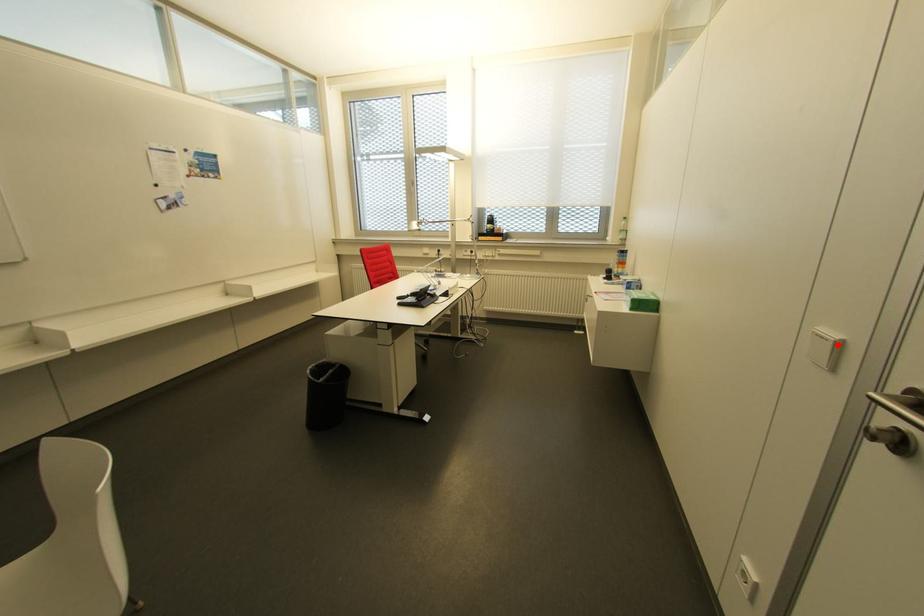
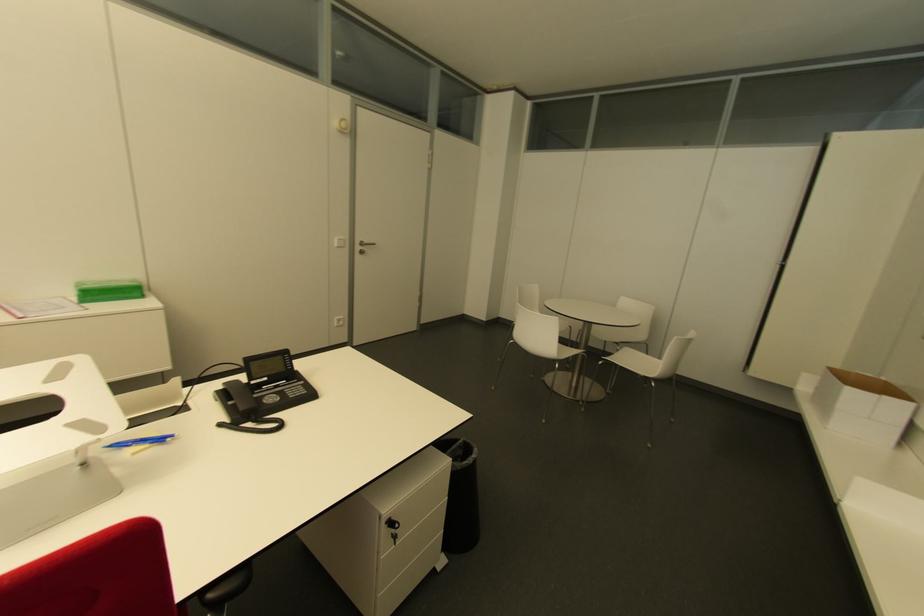
Question: I am providing you with two images of the same scene from different viewpoints. In image1, a red point is highlighted. Considering the same 3D point in image2, which of the following is correct?

Choices:
 (A) It is closer
 (B) It is farther

Answer: (A)